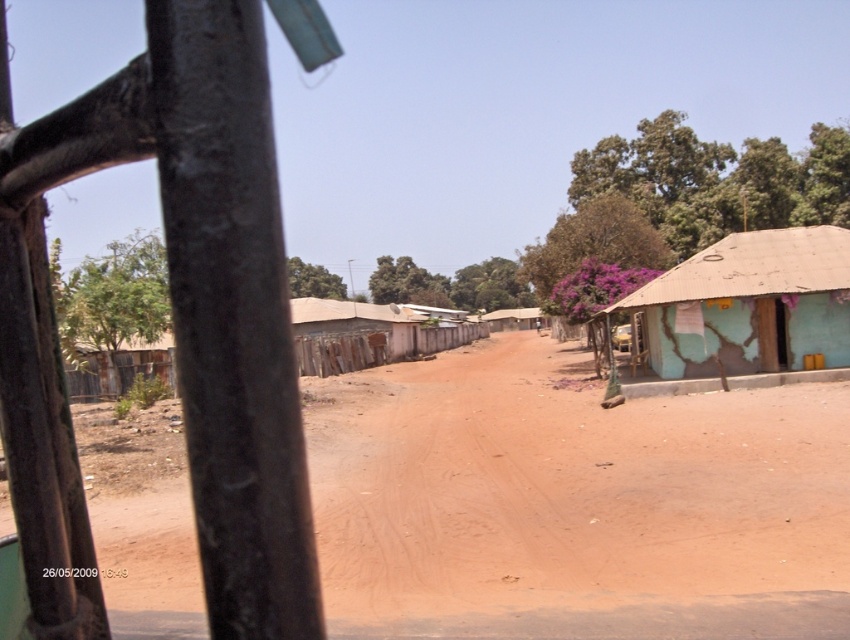
Question: Which object appears closest to the camera in this image?

Choices:
 (A) teal cracked wall hut at right
 (B) brown dirt field at center

Answer: (B)

Question: Does brown dirt field at center have a larger size compared to teal cracked wall hut at right?

Choices:
 (A) no
 (B) yes

Answer: (B)

Question: Does brown dirt field at center appear on the right side of teal cracked wall hut at right?

Choices:
 (A) no
 (B) yes

Answer: (A)

Question: Which of the following is the farthest from the observer?

Choices:
 (A) (431, 600)
 (B) (740, 355)

Answer: (B)

Question: Which object is closer to the camera taking this photo?

Choices:
 (A) brown dirt field at center
 (B) teal cracked wall hut at right

Answer: (A)

Question: Can you confirm if brown dirt field at center is positioned to the left of teal cracked wall hut at right?

Choices:
 (A) no
 (B) yes

Answer: (B)